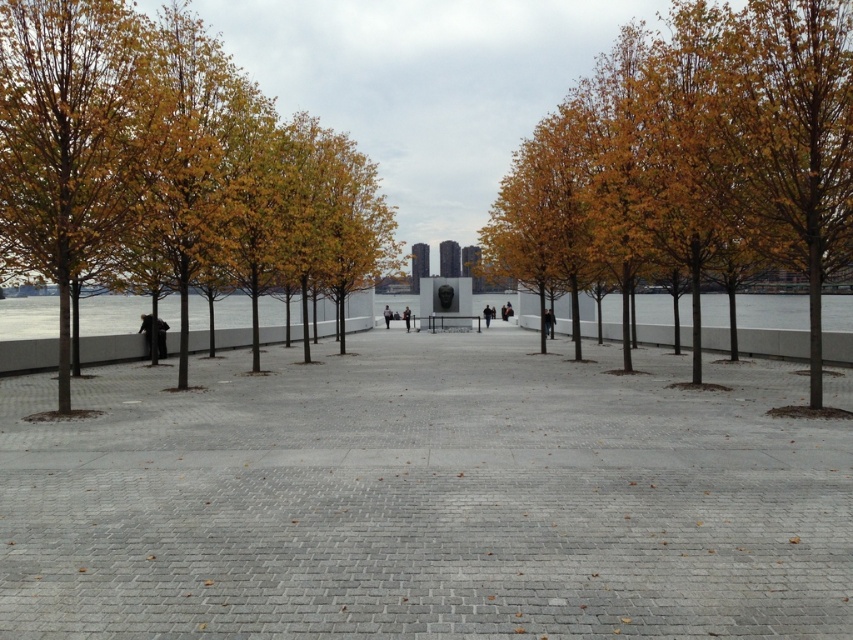
You are standing at the point marked as point [167,164] in the plaza. What is the nearest object to you?

The nearest object to you is the golden leafy tree at left, as the point [167,164] is located on it.

You are a maintenance worker tasked with trimming the golden leafy tree at left. You have a ladder that is 12 meters long. Can you safely place the ladder against the tree to reach the highest branches?

The golden leafy tree at left is 11.98 meters away from the ladder placement point. Since the ladder is 12 meters long, it can safely reach the tree as the distance is slightly less than the ladder length, allowing for a stable angle.